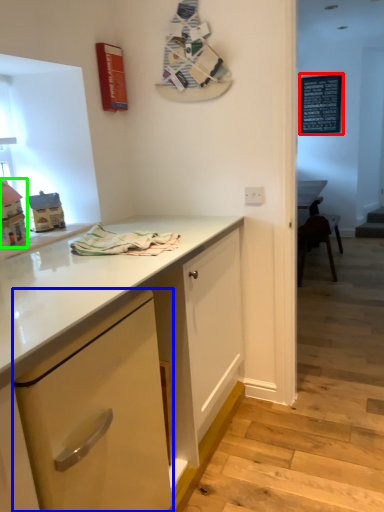
Question: Which is farther away from bulletin board (highlighted by a red box)? cabinetry (highlighted by a blue box) or toy (highlighted by a green box)?

Choices:
 (A) cabinetry
 (B) toy

Answer: (A)